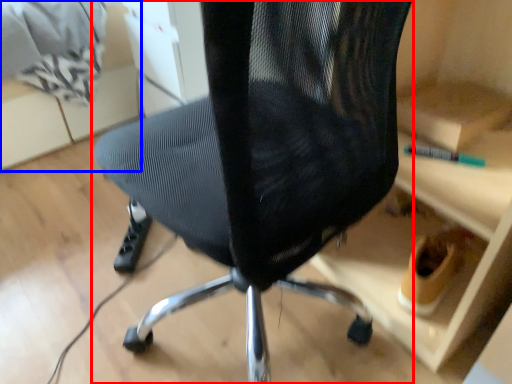
Question: Which object is closer to the camera taking this photo, chair (highlighted by a red box) or shelf (highlighted by a blue box)?

Choices:
 (A) chair
 (B) shelf

Answer: (A)